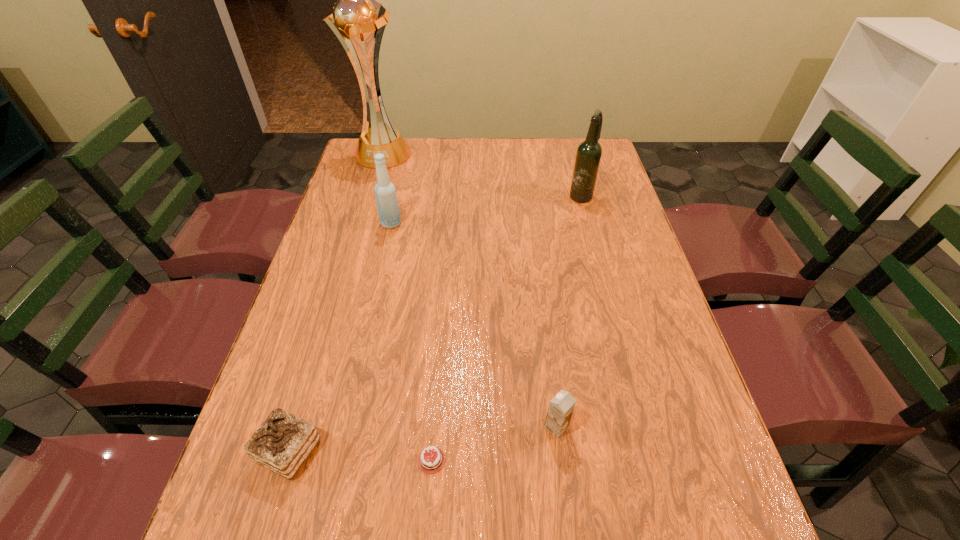
Identify the location of the shorter chocolate cake. The width and height of the screenshot is (960, 540). (430, 462).

The image size is (960, 540). I want to click on the fourth object from left to right, so click(x=430, y=462).

Find the location of `free space located on the front-facing side of the farthest object`. free space located on the front-facing side of the farthest object is located at coordinates (360, 228).

Where is `vacant point located on the left of the second tallest object`? This screenshot has height=540, width=960. vacant point located on the left of the second tallest object is located at coordinates (486, 195).

The image size is (960, 540). In order to click on vacant area situated 0.070m on the left of the third tallest object in this screenshot , I will do (358, 224).

The image size is (960, 540). I want to click on vacant point located 0.140m on the right of the second object from right to left, so click(638, 427).

I want to click on vacant space situated on the right of the taller chocolate cake, so click(x=376, y=451).

What are the coordinates of `vacant region located 0.300m on the back of the shortest object` in the screenshot? It's located at (443, 311).

The height and width of the screenshot is (540, 960). What are the coordinates of `object at the far edge` in the screenshot? It's located at (357, 15).

Find the location of a particular element. Image resolution: width=960 pixels, height=540 pixels. trophy that is at the left edge is located at coordinates pyautogui.click(x=357, y=15).